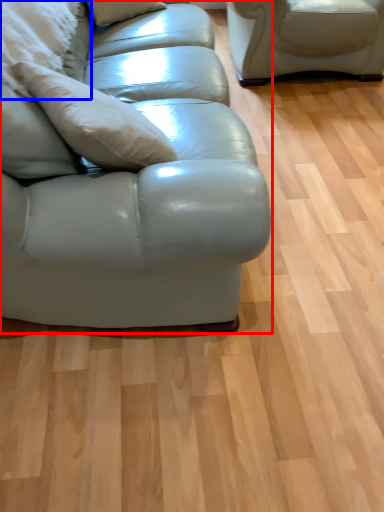
Question: Which point is further to the camera, studio couch (highlighted by a red box) or pillow (highlighted by a blue box)?

Choices:
 (A) studio couch
 (B) pillow

Answer: (B)